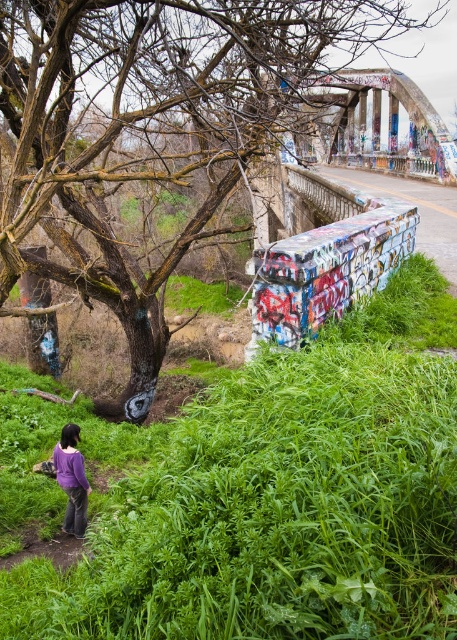
Question: Does green leafy grass at lower center have a lesser width compared to purple matte shirt at lower left?

Choices:
 (A) yes
 (B) no

Answer: (B)

Question: Which object is positioned closest to the green leafy grass at lower center?

Choices:
 (A) brown bark tree at upper left
 (B) purple matte shirt at lower left

Answer: (B)

Question: Considering the relative positions of green leafy grass at lower center and purple matte shirt at lower left in the image provided, where is green leafy grass at lower center located with respect to purple matte shirt at lower left?

Choices:
 (A) above
 (B) below

Answer: (A)

Question: In this image, where is brown bark tree at upper left located relative to purple matte shirt at lower left?

Choices:
 (A) above
 (B) below

Answer: (A)

Question: Which of the following is the farthest from the observer?

Choices:
 (A) (302, 572)
 (B) (79, 515)

Answer: (B)

Question: Which object is closer to the camera taking this photo?

Choices:
 (A) purple matte shirt at lower left
 (B) green leafy grass at lower center
 (C) brown bark tree at upper left

Answer: (B)